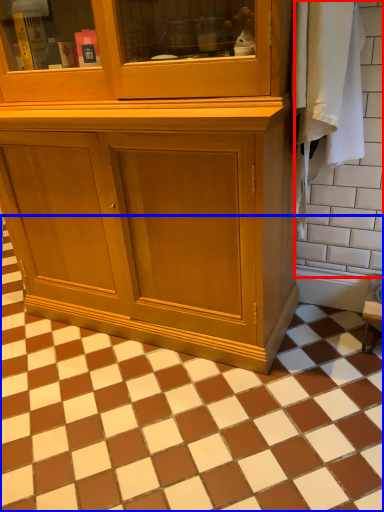
Question: Which of the following is the closest to the observer, ceramic tile (highlighted by a red box) or ceramic tile (highlighted by a blue box)?

Choices:
 (A) ceramic tile
 (B) ceramic tile

Answer: (B)